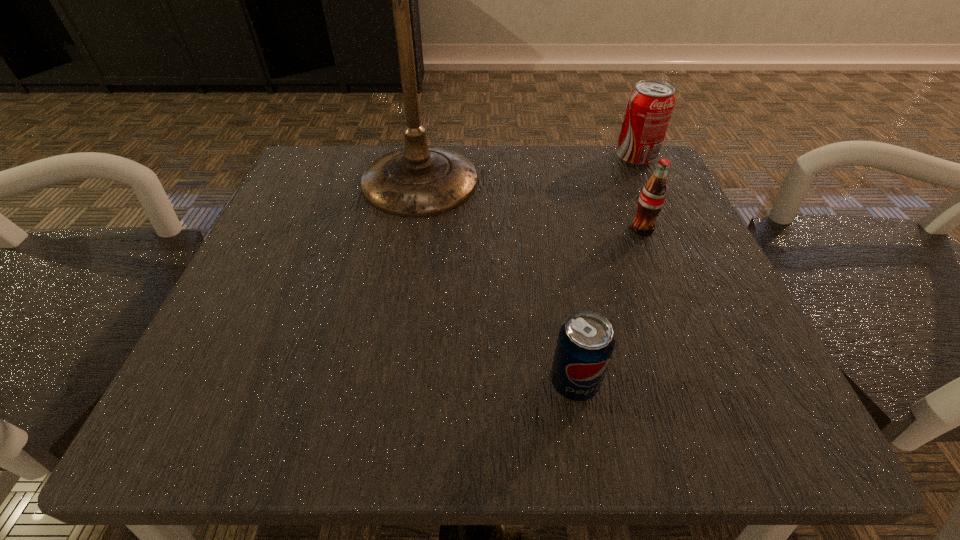
The width and height of the screenshot is (960, 540). Find the location of `free space that satisfies the following two spatial constraints: 1. above the green lampshade of the third object from right to left; 2. on the left side of the table lamp`. free space that satisfies the following two spatial constraints: 1. above the green lampshade of the third object from right to left; 2. on the left side of the table lamp is located at coordinates (387, 383).

Locate an element on the screen. The image size is (960, 540). free space that satisfies the following two spatial constraints: 1. above the green lampshade of the table lamp; 2. on the left side of the second nearest soda can is located at coordinates (413, 229).

Find the location of a particular element. The height and width of the screenshot is (540, 960). free space that satisfies the following two spatial constraints: 1. on the back side of the second nearest soda can; 2. on the left side of the farthest soda can is located at coordinates (613, 158).